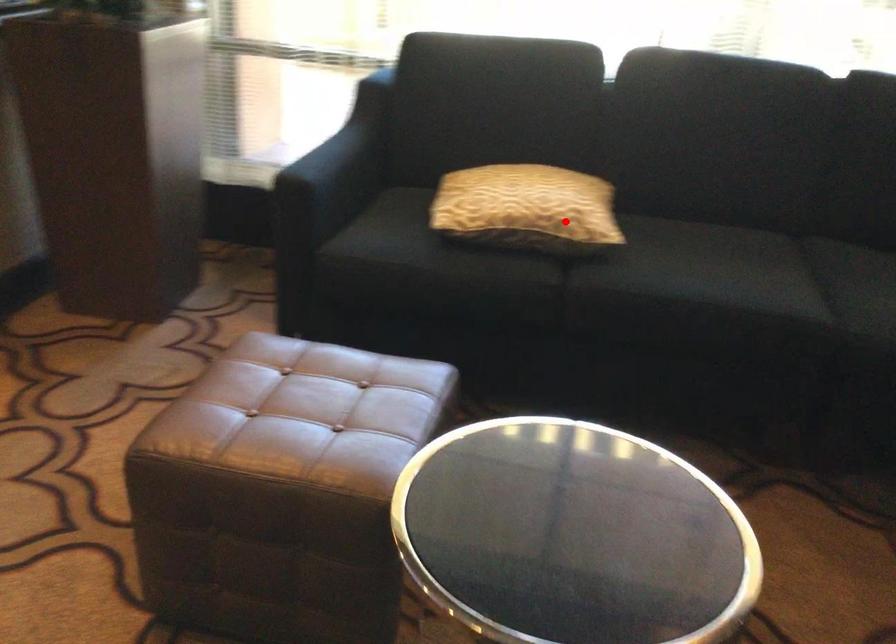
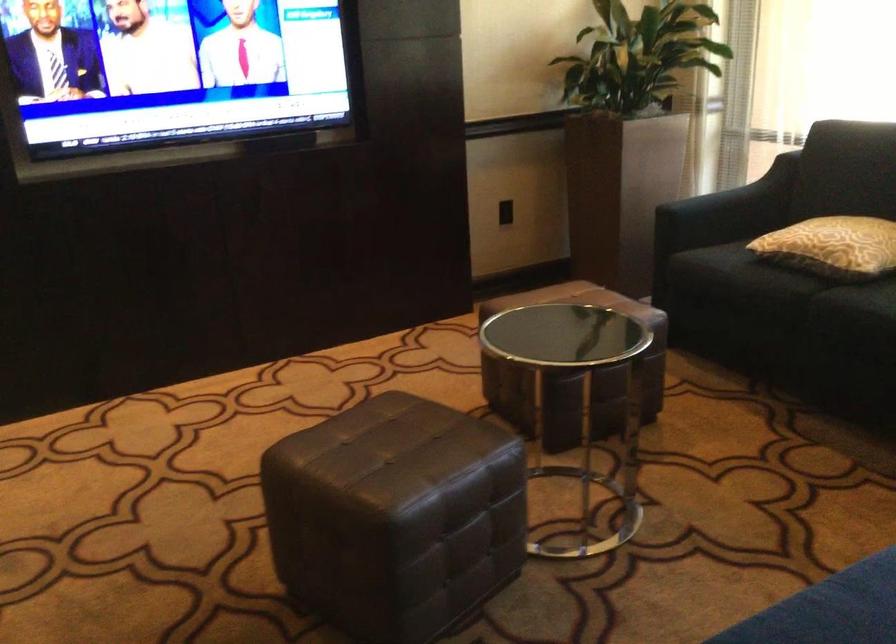
Question: I am providing you with two images of the same scene from different viewpoints. A red point is shown in image1. For the corresponding object point in image2, is it positioned nearer or farther from the camera?

Choices:
 (A) Nearer
 (B) Farther

Answer: (B)